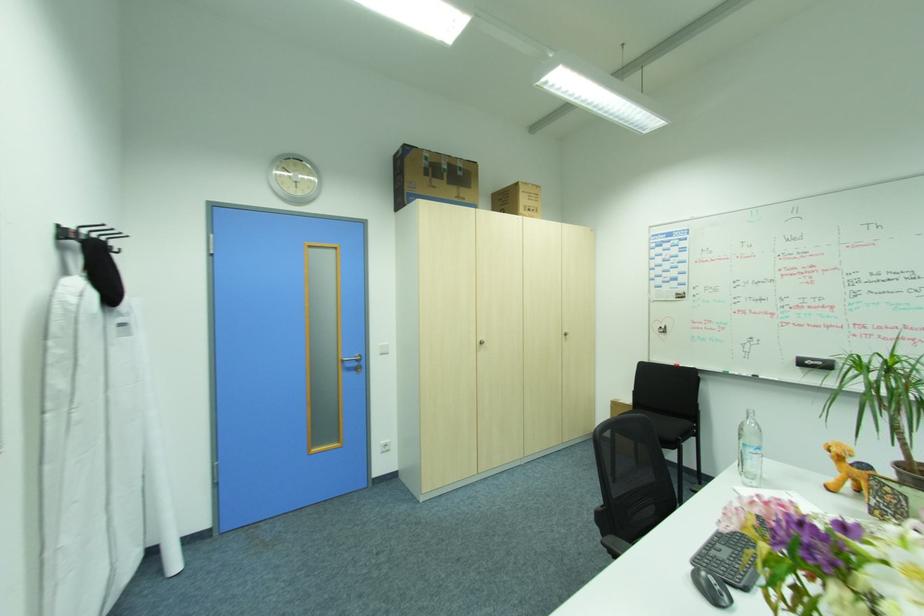
I want to click on chair armrest, so click(614, 545).